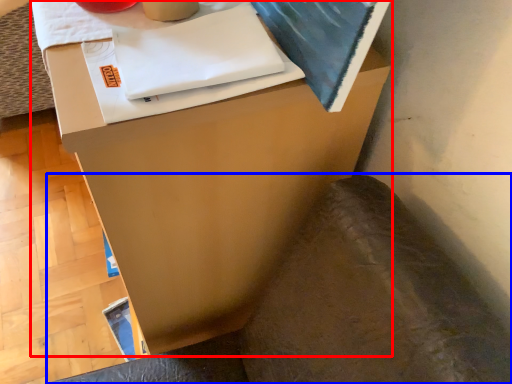
Question: Which object appears closest to the camera in this image, furniture (highlighted by a red box) or swivel chair (highlighted by a blue box)?

Choices:
 (A) furniture
 (B) swivel chair

Answer: (B)